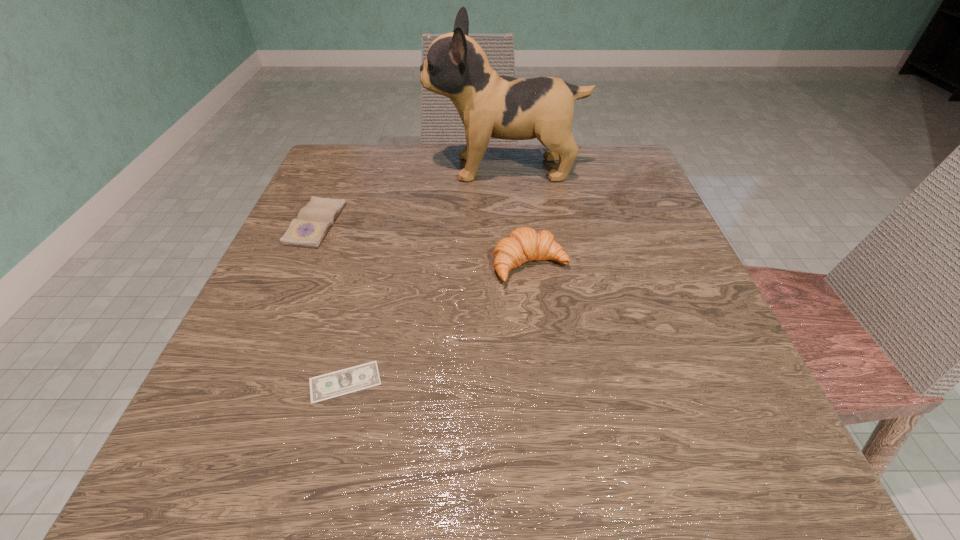
Where is `the farthest object`? This screenshot has width=960, height=540. the farthest object is located at coordinates (490, 105).

Where is `puppy`? Image resolution: width=960 pixels, height=540 pixels. puppy is located at coordinates (490, 105).

You are a GUI agent. You are given a task and a screenshot of the screen. Output one action in this format:
    pyautogui.click(x=<x>, y=<y>)
    Task: Click on the third shortest object
    The image size is (960, 540).
    Given the screenshot: What is the action you would take?
    pyautogui.click(x=523, y=244)

The width and height of the screenshot is (960, 540). Identify the location of diary. (308, 230).

At what (x,y) coordinates should I click in order to perform the action: click on the third tallest object. Please return your answer as a coordinate pair (x, y). Image resolution: width=960 pixels, height=540 pixels. Looking at the image, I should click on (308, 230).

This screenshot has width=960, height=540. In order to click on the shortest object in this screenshot , I will do `click(357, 378)`.

Where is `money`? money is located at coordinates (357, 378).

Identify the location of vacant point located at the face of the tallest object. This screenshot has height=540, width=960. (380, 168).

Find the location of `vacant space located at the face of the tallest object`. vacant space located at the face of the tallest object is located at coordinates (402, 168).

What are the coordinates of `vacant space located at the face of the tallest object` in the screenshot? It's located at (346, 168).